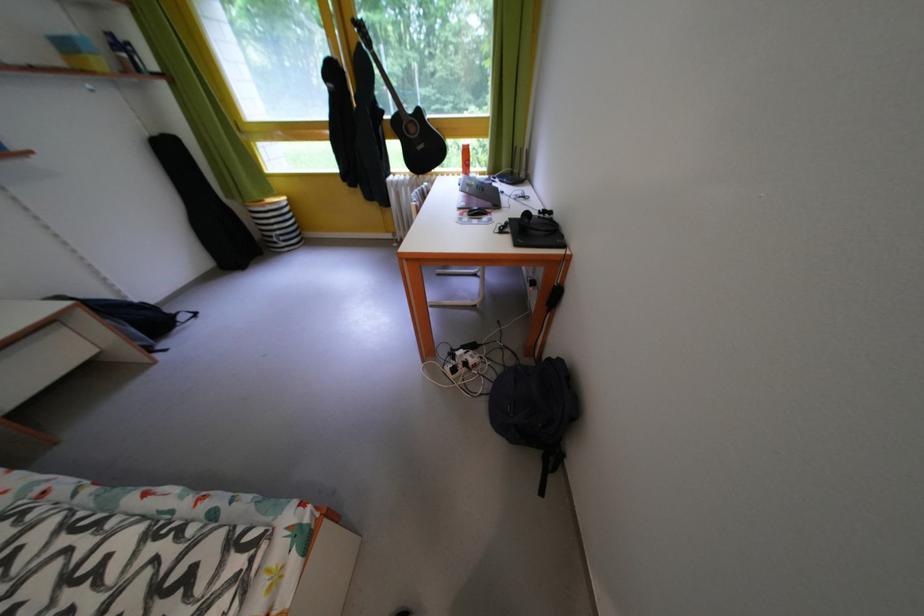
At what (x,y) coordinates should I click in order to perform the action: click on chair sitting surface. Please return your answer as a coordinate pair (x, y). This screenshot has width=924, height=616. Looking at the image, I should click on (225, 532).